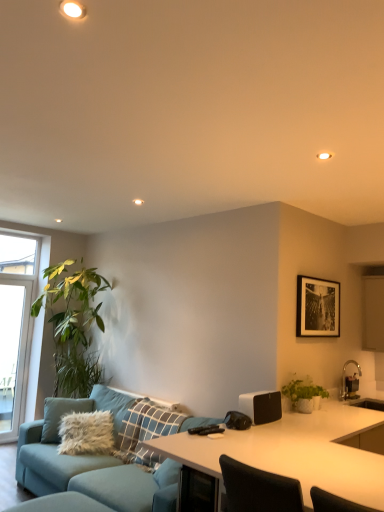
Question: Does teal fabric couch at center have a greater height compared to white glossy desk at center?

Choices:
 (A) no
 (B) yes

Answer: (A)

Question: Does teal fabric couch at center appear on the left side of white glossy desk at center?

Choices:
 (A) yes
 (B) no

Answer: (A)

Question: Considering the relative sizes of teal fabric couch at center and white glossy desk at center in the image provided, is teal fabric couch at center smaller than white glossy desk at center?

Choices:
 (A) no
 (B) yes

Answer: (B)

Question: Is teal fabric couch at center positioned in front of white glossy desk at center?

Choices:
 (A) yes
 (B) no

Answer: (B)

Question: Does teal fabric couch at center have a greater width compared to white glossy desk at center?

Choices:
 (A) yes
 (B) no

Answer: (B)

Question: In terms of height, does light blue fabric swivel chair at lower left look taller or shorter compared to white glossy desk at center?

Choices:
 (A) short
 (B) tall

Answer: (A)

Question: From the image's perspective, is light blue fabric swivel chair at lower left above or below white glossy desk at center?

Choices:
 (A) below
 (B) above

Answer: (A)

Question: Considering the positions of light blue fabric swivel chair at lower left and white glossy desk at center in the image, is light blue fabric swivel chair at lower left wider or thinner than white glossy desk at center?

Choices:
 (A) wide
 (B) thin

Answer: (B)

Question: Is light blue fabric swivel chair at lower left inside the boundaries of white glossy desk at center, or outside?

Choices:
 (A) outside
 (B) inside

Answer: (A)

Question: From a real-world perspective, relative to white matte speaker at right, is light blue fabric swivel chair at lower left vertically above or below?

Choices:
 (A) above
 (B) below

Answer: (B)

Question: Looking at their shapes, would you say light blue fabric swivel chair at lower left is wider or thinner than white matte speaker at right?

Choices:
 (A) thin
 (B) wide

Answer: (B)

Question: Which is correct: light blue fabric swivel chair at lower left is inside white matte speaker at right, or outside of it?

Choices:
 (A) inside
 (B) outside

Answer: (B)

Question: Relative to white matte speaker at right, is light blue fabric swivel chair at lower left in front or behind?

Choices:
 (A) behind
 (B) front

Answer: (B)

Question: Would you say transparent glass window at left is inside or outside white matte speaker at right?

Choices:
 (A) inside
 (B) outside

Answer: (B)

Question: Would you say transparent glass window at left is to the left or to the right of white matte speaker at right in the picture?

Choices:
 (A) right
 (B) left

Answer: (B)